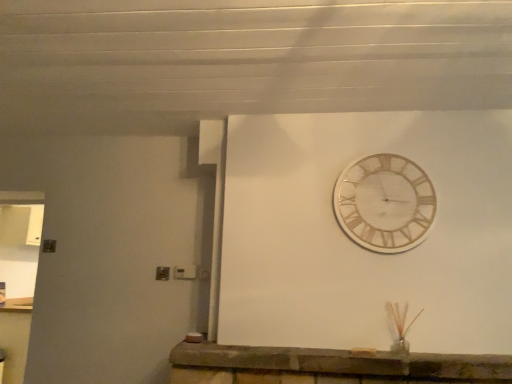
At what (x,y) coordinates should I click in order to perform the action: click on brick stone counter at lower center. Please return your answer as a coordinate pair (x, y). The height and width of the screenshot is (384, 512). Looking at the image, I should click on (328, 366).

What do you see at coordinates (328, 366) in the screenshot? This screenshot has width=512, height=384. I see `brick stone counter at lower center` at bounding box center [328, 366].

Describe the element at coordinates (384, 203) in the screenshot. I see `white marble clock at upper center` at that location.

You are a GUI agent. You are given a task and a screenshot of the screen. Output one action in this format:
    pyautogui.click(x=<x>, y=<y>)
    Task: Click on the white marble clock at upper center
    
    Given the screenshot: What is the action you would take?
    pyautogui.click(x=384, y=203)

Find the location of a particular element. The image size is (512, 384). brick stone counter at lower center is located at coordinates (328, 366).

Which is more to the right, white marble clock at upper center or brick stone counter at lower center?

Positioned to the right is white marble clock at upper center.

Is white marble clock at upper center closer to the viewer compared to brick stone counter at lower center?

No, the depth of white marble clock at upper center is greater than that of brick stone counter at lower center.

Consider the image. Which is further, (x=354, y=174) or (x=310, y=358)?

Positioned behind is point (x=354, y=174).

From the image's perspective, is white marble clock at upper center below brick stone counter at lower center?

No, from the image's perspective, white marble clock at upper center is not below brick stone counter at lower center.

From a real-world perspective, is white marble clock at upper center located beneath brick stone counter at lower center?

Actually, white marble clock at upper center is physically above brick stone counter at lower center in the real world.

Considering the relative sizes of white marble clock at upper center and brick stone counter at lower center in the image provided, is white marble clock at upper center wider than brick stone counter at lower center?

In fact, white marble clock at upper center might be narrower than brick stone counter at lower center.

From their relative heights in the image, would you say white marble clock at upper center is taller or shorter than brick stone counter at lower center?

white marble clock at upper center is taller than brick stone counter at lower center.

Is white marble clock at upper center bigger than brick stone counter at lower center?

Incorrect, white marble clock at upper center is not larger than brick stone counter at lower center.

Which is correct: white marble clock at upper center is inside brick stone counter at lower center, or outside of it?

white marble clock at upper center is located beyond the bounds of brick stone counter at lower center.

Does white marble clock at upper center touch brick stone counter at lower center?

There is a gap between white marble clock at upper center and brick stone counter at lower center.

Is white marble clock at upper center facing towards brick stone counter at lower center?

No, white marble clock at upper center is not aimed at brick stone counter at lower center.

Based on the photo, measure the distance between white marble clock at upper center and brick stone counter at lower center.

white marble clock at upper center is 32.06 inches away from brick stone counter at lower center.

You are a GUI agent. You are given a task and a screenshot of the screen. Output one action in this format:
    pyautogui.click(x=<x>, y=<y>)
    Task: Click on the counter directly beneath the white marble clock at upper center (from a real-world perspective)
    The image size is (512, 384).
    Given the screenshot: What is the action you would take?
    pyautogui.click(x=328, y=366)

Does brick stone counter at lower center appear on the right side of white marble clock at upper center?

No.

Which is in front, brick stone counter at lower center or white marble clock at upper center?

brick stone counter at lower center is in front.

Between point (194, 352) and point (387, 179), which one is positioned in front?

The point (194, 352) is closer.

From the image's perspective, is brick stone counter at lower center positioned above or below white marble clock at upper center?

brick stone counter at lower center is below white marble clock at upper center.

From a real-world perspective, which object stands above the other?

white marble clock at upper center, from a real-world perspective.

Considering the relative sizes of brick stone counter at lower center and white marble clock at upper center in the image provided, is brick stone counter at lower center thinner than white marble clock at upper center?

No, brick stone counter at lower center is not thinner than white marble clock at upper center.

Considering the relative sizes of brick stone counter at lower center and white marble clock at upper center in the image provided, is brick stone counter at lower center shorter than white marble clock at upper center?

Correct, brick stone counter at lower center is not as tall as white marble clock at upper center.

Between brick stone counter at lower center and white marble clock at upper center, which one has smaller size?

Smaller between the two is white marble clock at upper center.

Does brick stone counter at lower center contain white marble clock at upper center?

No, white marble clock at upper center is located outside of brick stone counter at lower center.

Based on the photo, would you say brick stone counter at lower center is a long distance from white marble clock at upper center?

brick stone counter at lower center is near white marble clock at upper center, not far away.

Is brick stone counter at lower center facing away from white marble clock at upper center?

→ That's not correct — brick stone counter at lower center is not looking away from white marble clock at upper center.

Measure the distance from brick stone counter at lower center to white marble clock at upper center.

The distance of brick stone counter at lower center from white marble clock at upper center is 32.06 inches.

You are a GUI agent. You are given a task and a screenshot of the screen. Output one action in this format:
    pyautogui.click(x=<x>, y=<y>)
    Task: Click on the counter that is under the white marble clock at upper center (from a real-world perspective)
    This screenshot has width=512, height=384.
    Given the screenshot: What is the action you would take?
    pyautogui.click(x=328, y=366)

Where is `counter below the white marble clock at upper center (from the image's perspective)`? counter below the white marble clock at upper center (from the image's perspective) is located at coordinates (328, 366).

Where is `counter on the left of the white marble clock at upper center`? Image resolution: width=512 pixels, height=384 pixels. counter on the left of the white marble clock at upper center is located at coordinates (328, 366).